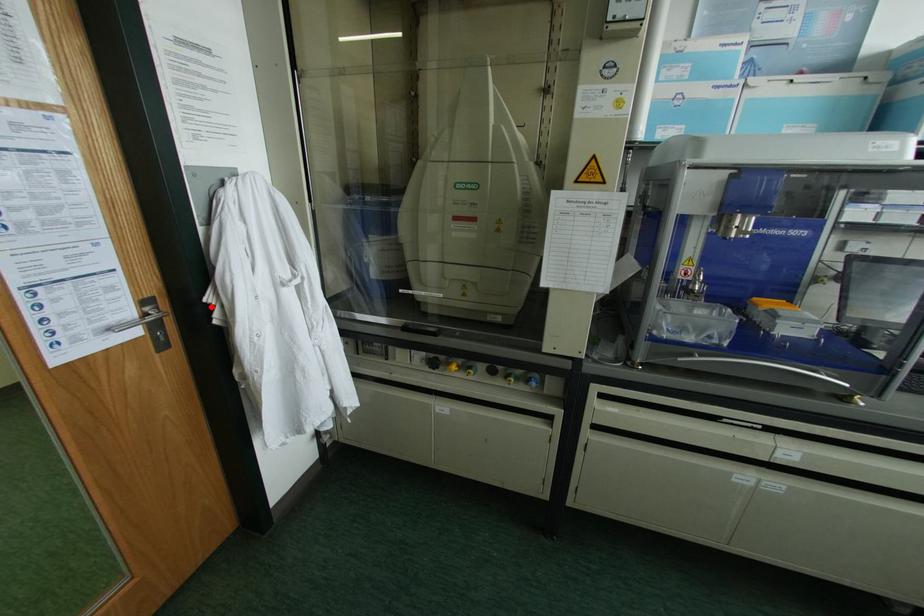
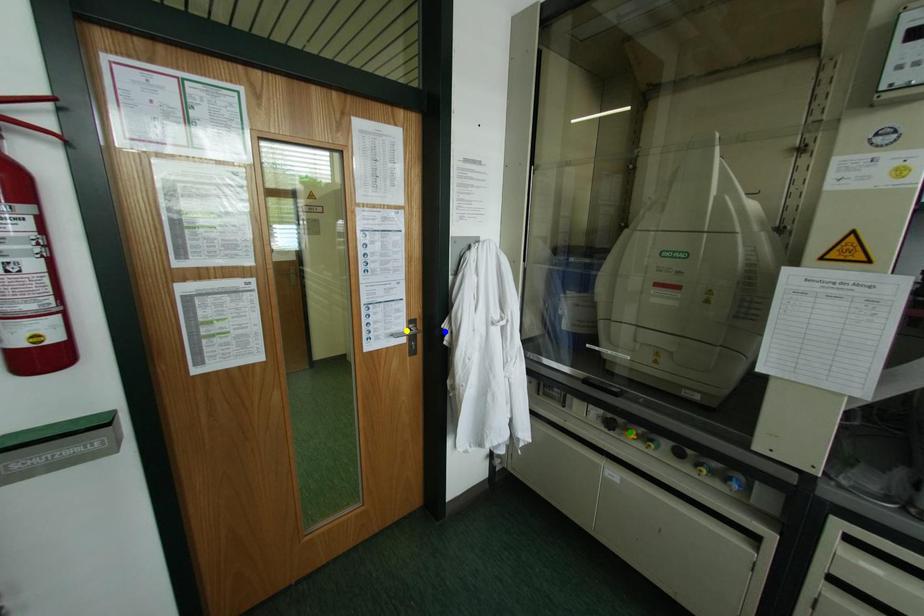
Question: I am providing you with two images of the same scene from different viewpoints. A red point is marked on the first image. You are given multiple points on the second image. In image 2, which mark is for the same physical point as the one in image 1?

Choices:
 (A) yellow point
 (B) blue point
 (C) green point

Answer: (B)